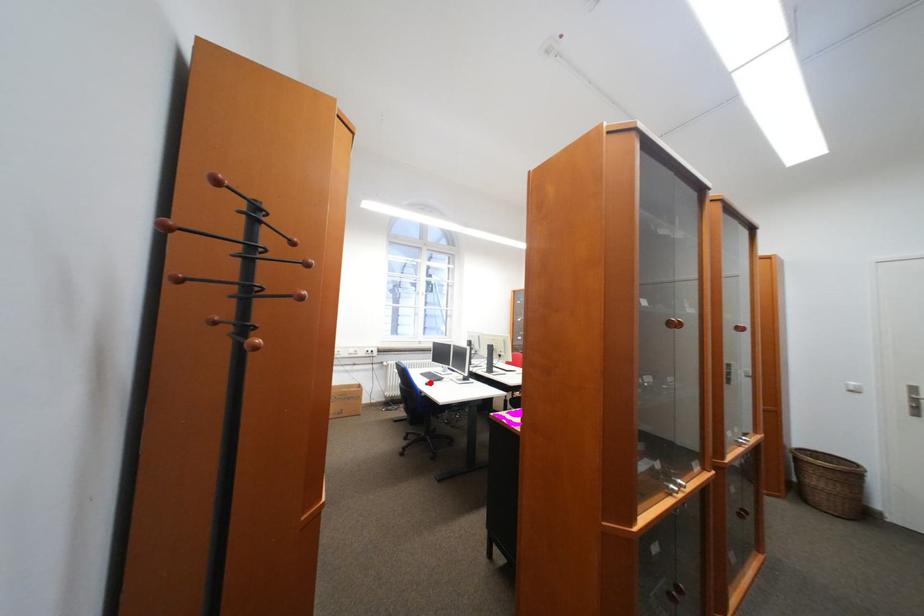
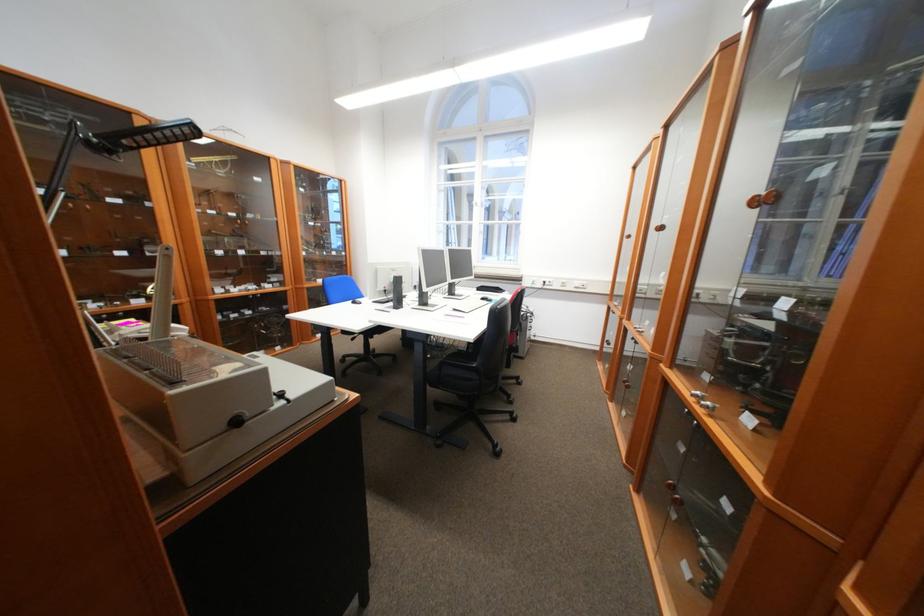
Question: I am providing you with two images of the same scene from different viewpoints. A red point is marked on the first image. Is the red point's position out of view in image 2?

Choices:
 (A) Yes
 (B) No

Answer: (A)